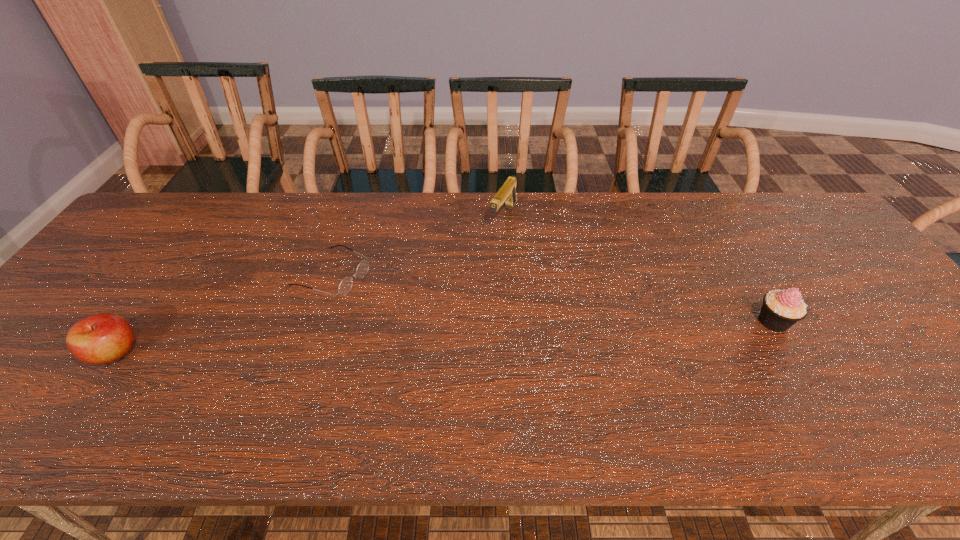
Where is `free space located 0.190m at the barrel of the farthest object`? The image size is (960, 540). free space located 0.190m at the barrel of the farthest object is located at coordinates (472, 272).

Locate an element on the screen. This screenshot has height=540, width=960. vacant space located through the lenses of the second farthest object is located at coordinates (460, 325).

The width and height of the screenshot is (960, 540). I want to click on vacant space located 0.230m through the lenses of the second farthest object, so tap(439, 316).

Locate an element on the screen. The width and height of the screenshot is (960, 540). vacant space positioned 0.310m through the lenses of the second farthest object is located at coordinates (467, 327).

Image resolution: width=960 pixels, height=540 pixels. I want to click on object present at the far edge, so click(x=507, y=193).

Where is `object that is at the near edge`? The height and width of the screenshot is (540, 960). object that is at the near edge is located at coordinates (102, 338).

This screenshot has width=960, height=540. I want to click on object present at the left edge, so click(102, 338).

You are a GUI agent. You are given a task and a screenshot of the screen. Output one action in this format:
    pyautogui.click(x=<x>, y=<y>)
    Task: Click on the object that is positioned at the near left corner
    
    Given the screenshot: What is the action you would take?
    pyautogui.click(x=102, y=338)

In the image, there is a desktop. Identify the location of free region at the far edge. (771, 234).

The height and width of the screenshot is (540, 960). I want to click on free space at the near edge of the desktop, so click(453, 385).